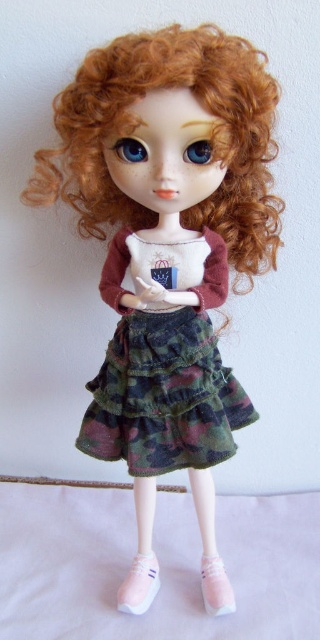
Who is higher up, camouflage fabric skirt at center or pink suede shoe at lower center?

camouflage fabric skirt at center is higher up.

Who is positioned more to the right, camouflage fabric skirt at center or pink suede shoe at lower center?

pink suede shoe at lower center is more to the right.

Does point (221, 269) lie in front of point (207, 586)?

Yes, it is.

Where is `camouflage fabric skirt at center`? This screenshot has width=320, height=640. camouflage fabric skirt at center is located at coordinates (165, 372).

Can you confirm if camouflage fabric skirt at center is shorter than pink fabric shoe at lower center?

No, camouflage fabric skirt at center is not shorter than pink fabric shoe at lower center.

Can you confirm if camouflage fabric skirt at center is positioned to the left of pink fabric shoe at lower center?

No, camouflage fabric skirt at center is not to the left of pink fabric shoe at lower center.

Identify the location of camouflage fabric skirt at center. (165, 372).

Can you confirm if pink fabric shoe at lower center is positioned to the left of pink suede shoe at lower center?

Correct, you'll find pink fabric shoe at lower center to the left of pink suede shoe at lower center.

Who is lower down, pink fabric shoe at lower center or pink suede shoe at lower center?

Positioned lower is pink fabric shoe at lower center.

Is point (124, 588) farther from viewer compared to point (206, 611)?

Yes.

Image resolution: width=320 pixels, height=640 pixels. I want to click on pink fabric shoe at lower center, so click(138, 586).